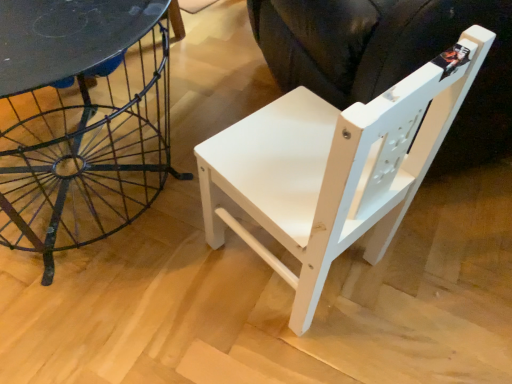
Where is `free space that is in between white matte wood chair at center and metallic black table at left`? This screenshot has width=512, height=384. free space that is in between white matte wood chair at center and metallic black table at left is located at coordinates (180, 267).